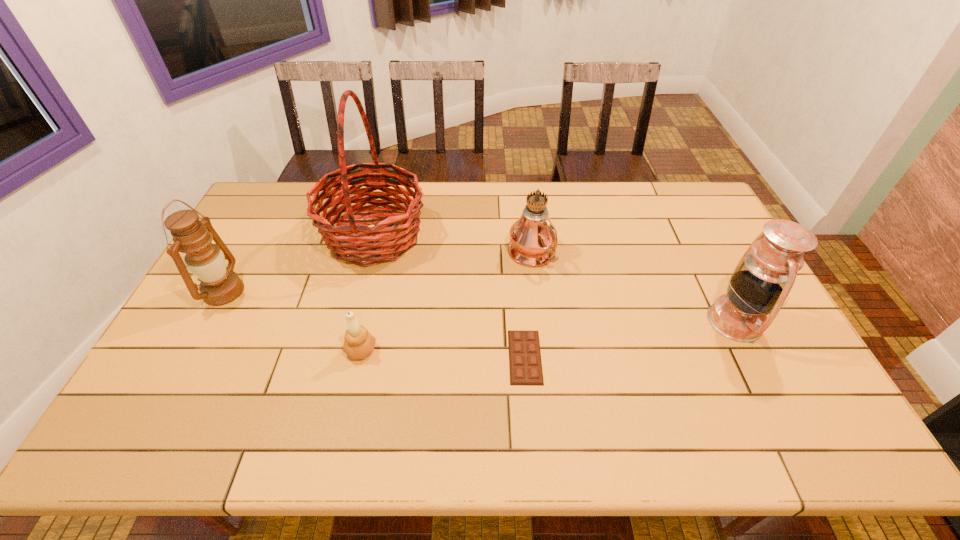
This screenshot has height=540, width=960. In order to click on vacant point located between the leftmost object and the shortest object in this screenshot , I will do click(374, 324).

Identify the location of free spot between the leftmost object and the second shortest object. (293, 321).

At what (x,y) coordinates should I click in order to perform the action: click on vacant area that lies between the leftmost object and the fifth tallest object. Please return your answer as a coordinate pair (x, y). The image size is (960, 540). Looking at the image, I should click on (293, 321).

The image size is (960, 540). Identify the location of vacant region between the tallest object and the shortest object. (449, 296).

Where is `empty space between the chocolate bar and the rightmost object`? The image size is (960, 540). empty space between the chocolate bar and the rightmost object is located at coordinates (630, 339).

Find the location of `vacant space in between the basket and the leftmost object`. vacant space in between the basket and the leftmost object is located at coordinates (299, 263).

This screenshot has width=960, height=540. What are the coordinates of `free space between the tallest oil lamp and the basket` in the screenshot? It's located at (453, 245).

The height and width of the screenshot is (540, 960). Identify the location of vacant space that's between the leftmost oil lamp and the shortest object. (374, 324).

What are the coordinates of `free space between the candle_holder and the leftmost object` in the screenshot? It's located at (293, 321).

Where is `free space that is in between the tallest object and the leftmost object`? free space that is in between the tallest object and the leftmost object is located at coordinates (299, 263).